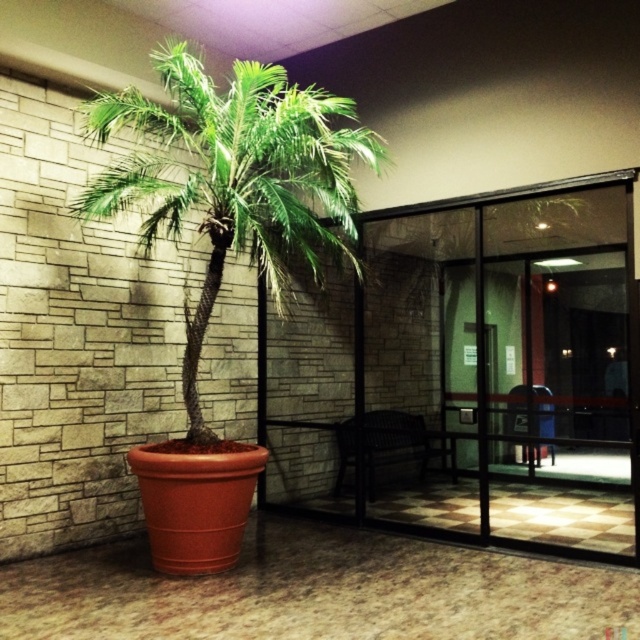
Is transparent glass door at center to the left of green leafy palm tree at center from the viewer's perspective?

No, transparent glass door at center is not to the left of green leafy palm tree at center.

Which is behind, point (541, 433) or point (342, 252)?

The point (342, 252) is more distant.

Between point (576, 349) and point (260, 268), which one is positioned in front?

Point (576, 349)

At what (x,y) coordinates should I click in order to perform the action: click on transparent glass door at center. Please return your answer as a coordinate pair (x, y). This screenshot has height=640, width=640. Looking at the image, I should click on (470, 376).